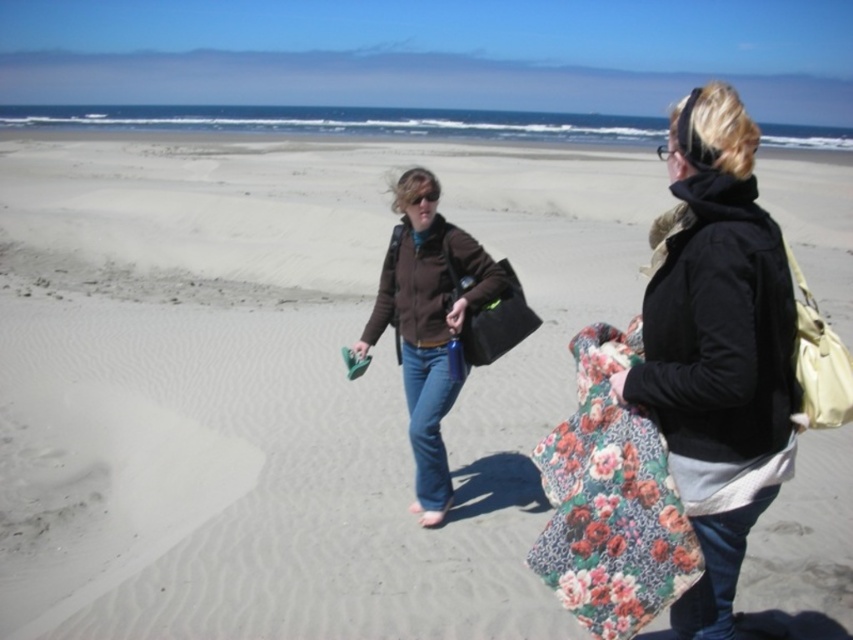
Question: Which is nearer to the matte black bag at center?

Choices:
 (A) floral fabric blanket at center
 (B) brown matte jacket at center
 (C) floral fabric shopping bag at right

Answer: (B)

Question: Where is floral fabric blanket at center located in relation to floral fabric shopping bag at right in the image?

Choices:
 (A) above
 (B) below

Answer: (A)

Question: Can you confirm if floral fabric shopping bag at right is smaller than matte black bag at center?

Choices:
 (A) yes
 (B) no

Answer: (B)

Question: Is floral fabric shopping bag at right to the right of brown matte jacket at center from the viewer's perspective?

Choices:
 (A) yes
 (B) no

Answer: (A)

Question: Which object is closer to the camera taking this photo?

Choices:
 (A) floral fabric shopping bag at right
 (B) floral fabric blanket at center
 (C) matte black bag at center
 (D) brown matte jacket at center

Answer: (B)

Question: Among these objects, which one is farthest from the camera?

Choices:
 (A) floral fabric blanket at center
 (B) matte black bag at center

Answer: (B)